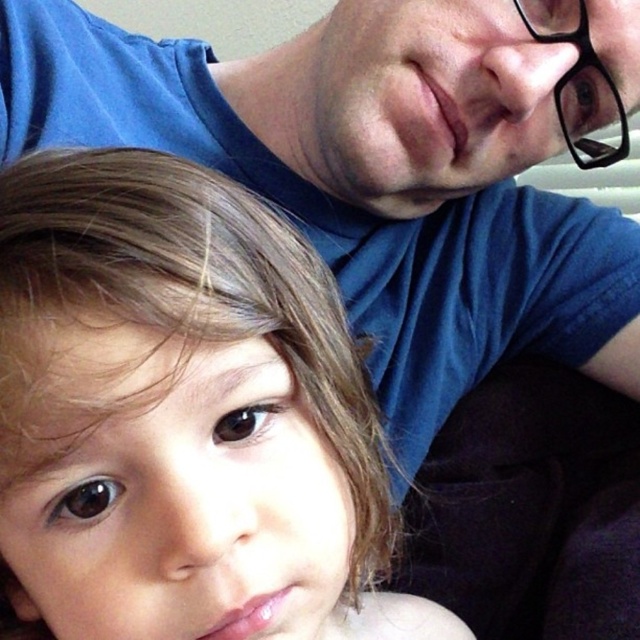
You are standing in front of the image and want to touch the two points shown. Which point, point (33, 336) or point (550, 8), is closer to you?

Point (33, 336) is closer to the viewer than point (550, 8).

Based on the photo, you are a photographer trying to adjust the lighting in this scene. You notice the smooth skin child at lower left and the black plastic glasses at upper right. Which object is located more to the left side of the scene?

→ The smooth skin child at lower left is positioned on the left side of black plastic glasses at upper right, so the smooth skin child at lower left is more to the left.